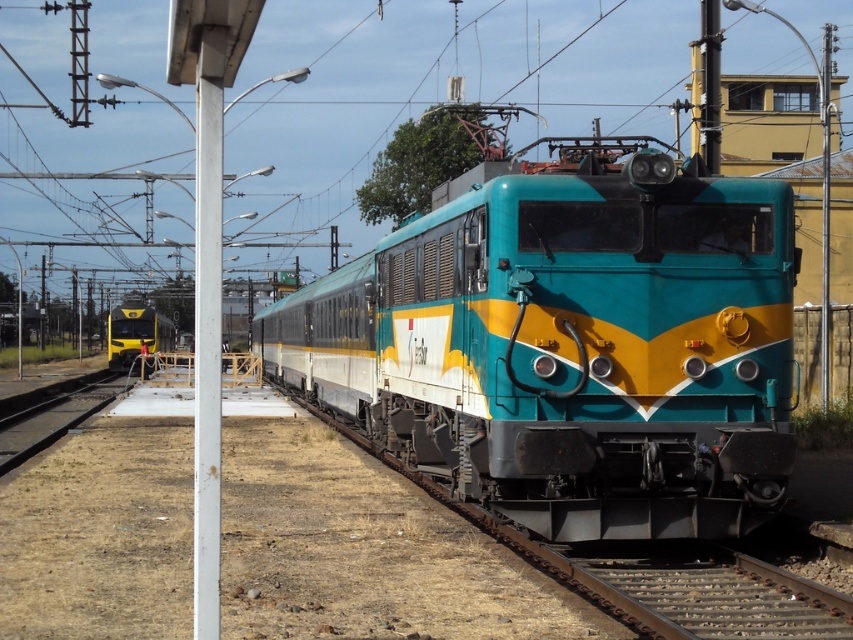
Question: Which point is closer to the camera?

Choices:
 (A) (158, 337)
 (B) (473, 317)

Answer: (B)

Question: Does teal glossy train at center have a larger size compared to yellow glossy train at left?

Choices:
 (A) no
 (B) yes

Answer: (B)

Question: Does teal glossy train at center appear on the right side of yellow glossy train at left?

Choices:
 (A) no
 (B) yes

Answer: (B)

Question: Does teal glossy train at center have a greater width compared to yellow glossy train at left?

Choices:
 (A) yes
 (B) no

Answer: (A)